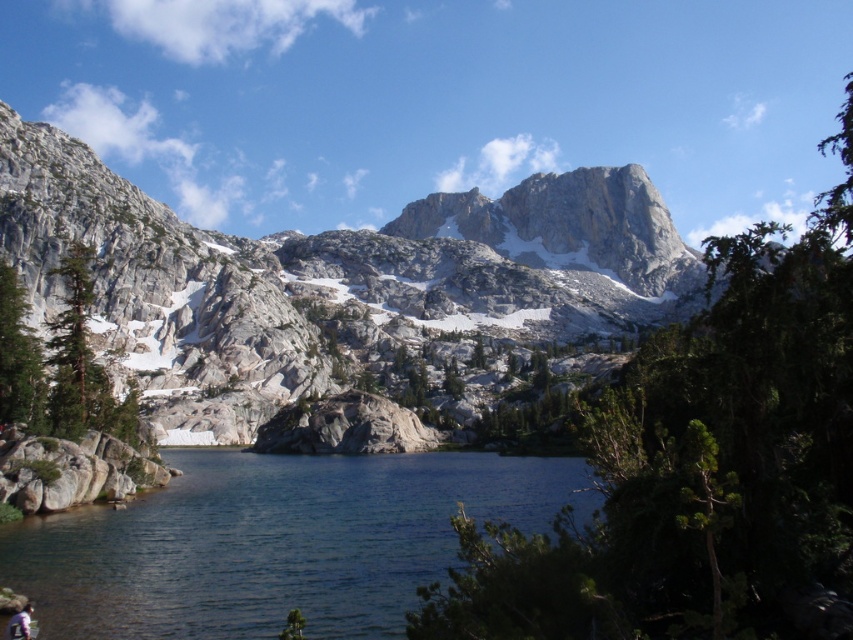
You are a hiker planning to cross the clear water at center to reach the white rocky mountain at center. Given that the mountain is larger, do you think the water is deeper near the mountain?

The white rocky mountain at center has a larger size compared to clear water at center, but the size of the mountain does not directly indicate the depth of the water. The depth of the water near the mountain cannot be determined solely based on the mountain size.